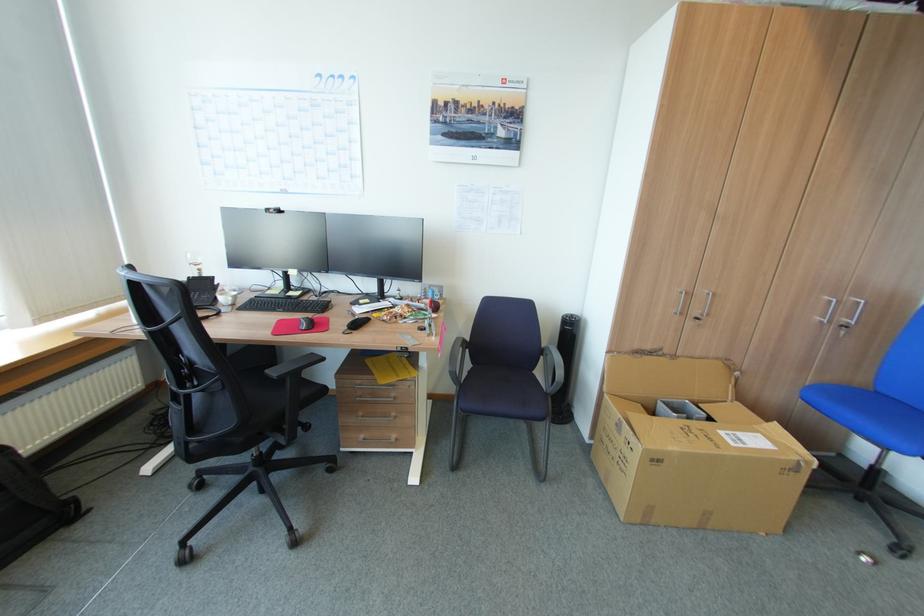
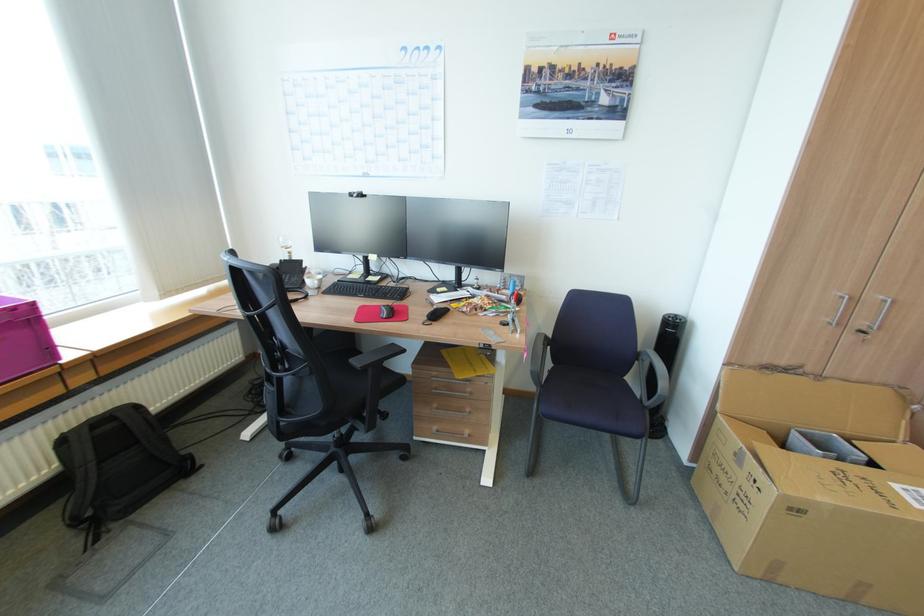
Find the pixel in the second image that matches the point at 395,416 in the first image.

(468, 411)